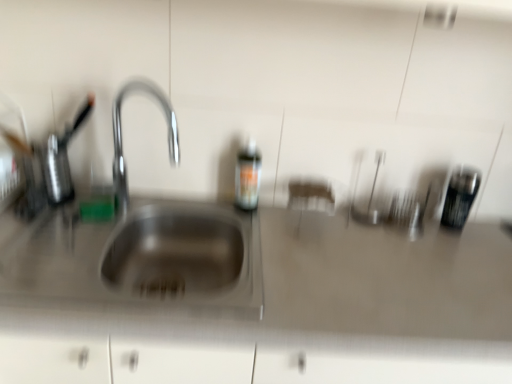
Identify the location of free point to the left of translucent plastic bottle at center. The width and height of the screenshot is (512, 384). (203, 206).